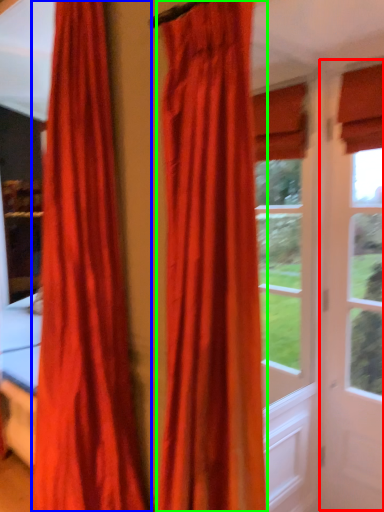
Question: Estimate the real-world distances between objects in this image. Which object is closer to screen door (highlighted by a red box), curtain (highlighted by a blue box) or curtain (highlighted by a green box)?

Choices:
 (A) curtain
 (B) curtain

Answer: (B)